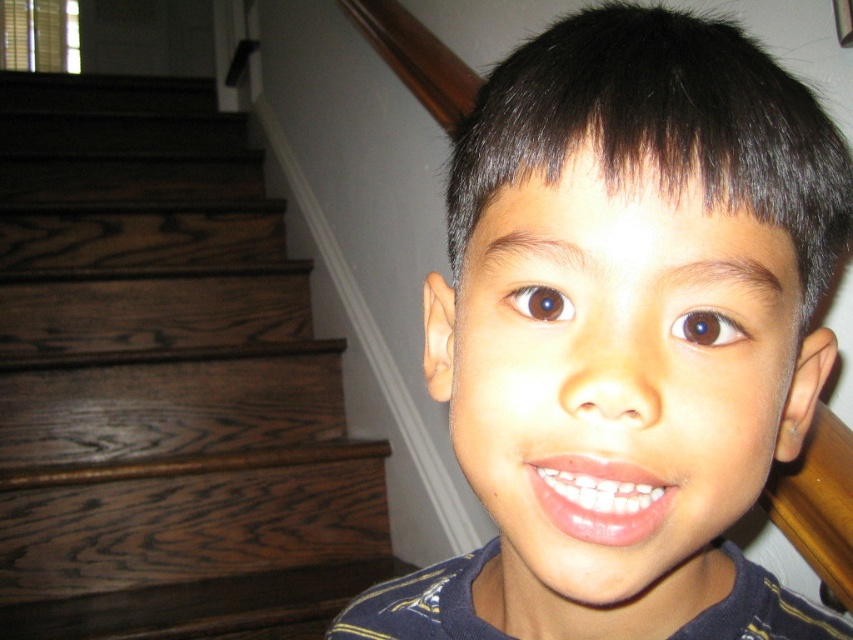
Question: Among these objects, which one is farthest from the camera?

Choices:
 (A) smooth skin face at center
 (B) dark brown wood stairs at left

Answer: (B)

Question: Is smooth skin face at center to the left of dark brown wood stairs at left from the viewer's perspective?

Choices:
 (A) yes
 (B) no

Answer: (B)

Question: From the image, what is the correct spatial relationship of smooth skin face at center in relation to dark brown wood stairs at left?

Choices:
 (A) left
 (B) right

Answer: (B)

Question: Is smooth skin face at center above dark brown wood stairs at left?

Choices:
 (A) no
 (B) yes

Answer: (B)

Question: Which object is farther from the camera taking this photo?

Choices:
 (A) smooth skin face at center
 (B) dark brown wood stairs at left

Answer: (B)